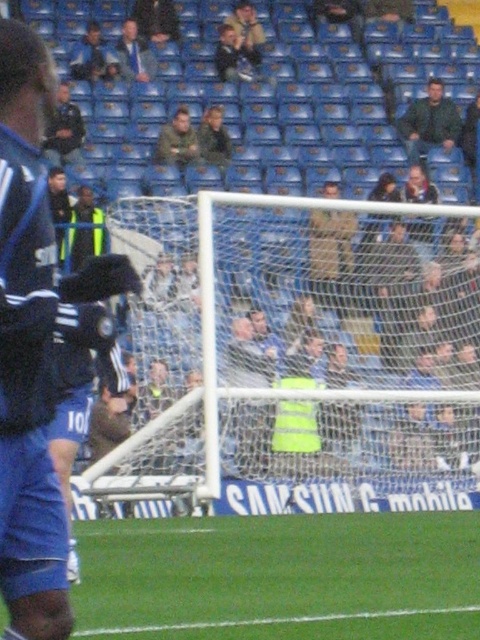
Question: Estimate the real-world distances between objects in this image. Which object is farther from the camouflage jacket at center?

Choices:
 (A) light brown leather jacket at center
 (B) dark blue jersey at upper left
 (C) dark blue jersey at center
 (D) white mesh net at center

Answer: (D)

Question: Is dark blue jersey at upper left smaller than light brown leather jacket at center?

Choices:
 (A) no
 (B) yes

Answer: (A)

Question: Among these points, which one is farthest from the camera?

Choices:
 (A) (55, 132)
 (B) (82, 323)

Answer: (A)

Question: Which point appears closest to the camera in this image?

Choices:
 (A) (199, 132)
 (B) (59, 129)

Answer: (B)

Question: Can you confirm if camouflage jacket at center is smaller than light brown leather jacket at center?

Choices:
 (A) no
 (B) yes

Answer: (A)

Question: Does blue jersey at upper left have a lesser width compared to light brown leather jacket at center?

Choices:
 (A) yes
 (B) no

Answer: (B)